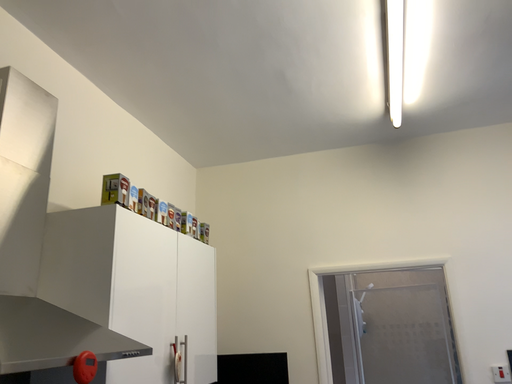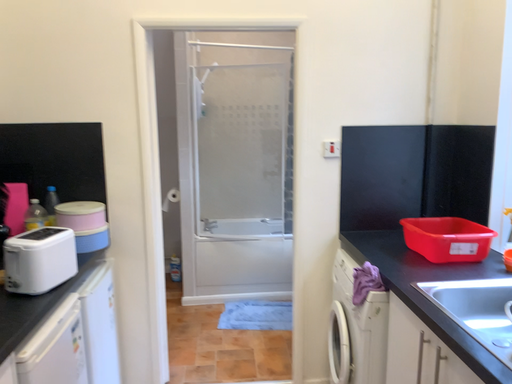
Question: Which way did the camera rotate in the video?

Choices:
 (A) rotated upward
 (B) rotated downward

Answer: (B)